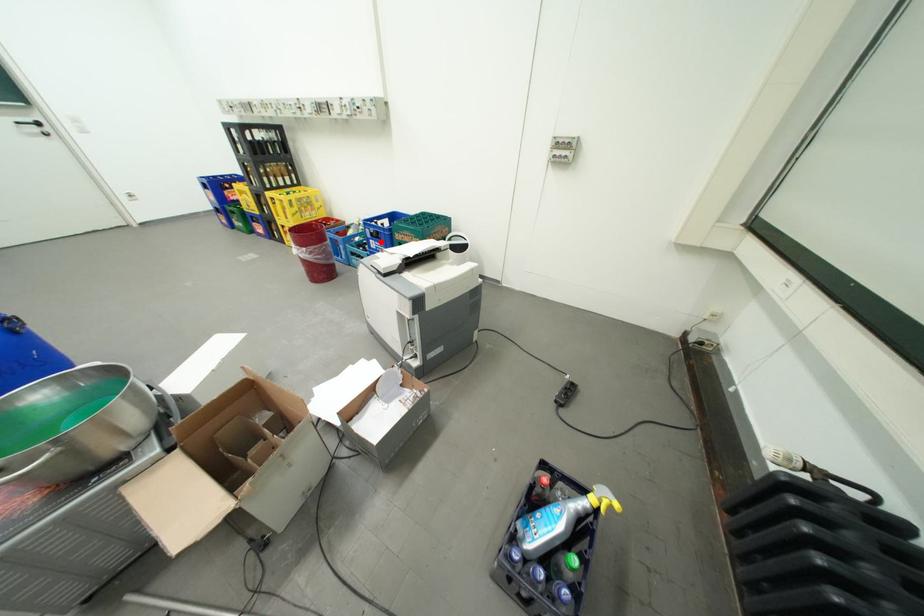
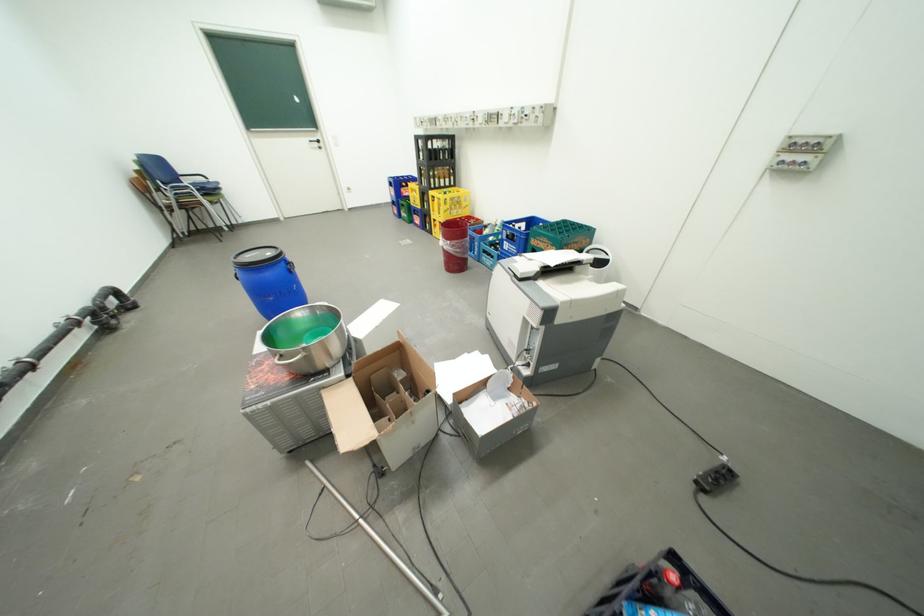
Question: I am providing you with two images of the same scene from different viewpoints. Image1 has a red point marked. In image2, the corresponding 3D location appears at what relative position? Reply with the corresponding letter.

Choices:
 (A) Closer
 (B) Farther

Answer: (A)